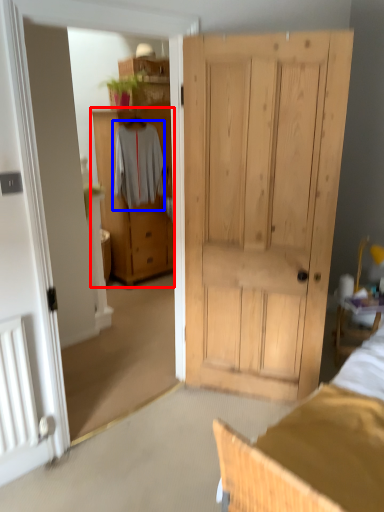
Question: Which point is closer to the camera, cabinetry (highlighted by a red box) or clothing (highlighted by a blue box)?

Choices:
 (A) cabinetry
 (B) clothing

Answer: (B)